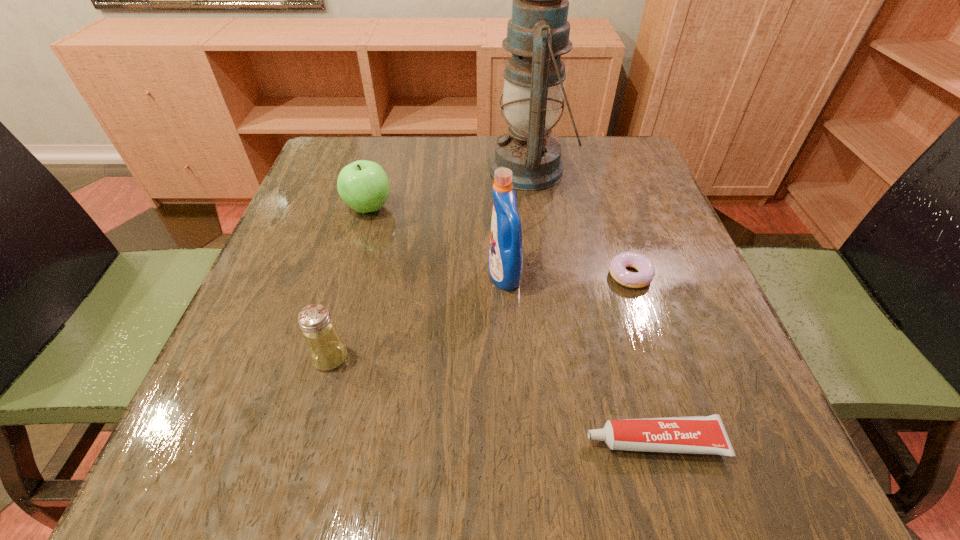
This screenshot has height=540, width=960. Find the location of `saltshaker present at the left edge`. saltshaker present at the left edge is located at coordinates (326, 349).

This screenshot has width=960, height=540. I want to click on toothpaste situated at the right edge, so click(x=706, y=434).

Where is `doughnut positioned at the right edge`? Image resolution: width=960 pixels, height=540 pixels. doughnut positioned at the right edge is located at coordinates (644, 276).

This screenshot has width=960, height=540. I want to click on object present at the near right corner, so click(x=706, y=434).

At what (x,y) coordinates should I click in order to perform the action: click on vacant space at the far edge of the desktop. Please return your answer as a coordinate pair (x, y). The height and width of the screenshot is (540, 960). Looking at the image, I should click on (387, 158).

Where is `free space at the left edge of the desktop`? Image resolution: width=960 pixels, height=540 pixels. free space at the left edge of the desktop is located at coordinates (262, 360).

Identify the location of free spot at the right edge of the desktop. This screenshot has width=960, height=540. (595, 214).

Identify the location of vacant space at the far right corner of the desktop. The height and width of the screenshot is (540, 960). (637, 146).

Where is `free point at the near right corner`? This screenshot has height=540, width=960. free point at the near right corner is located at coordinates (732, 464).

Where is `vacant area that lies between the second nearest object and the apple`? vacant area that lies between the second nearest object and the apple is located at coordinates (349, 282).